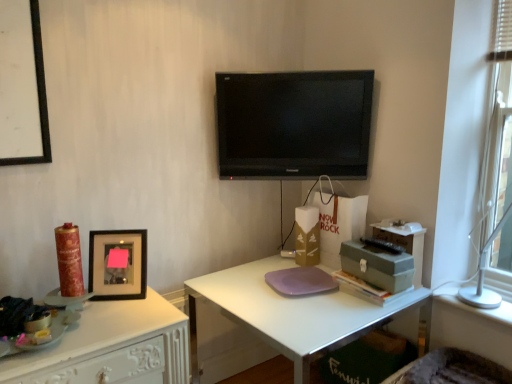
Question: Are white matte desk at center, the second desk from the left, and black glossy flat-screen tv at center making contact?

Choices:
 (A) no
 (B) yes

Answer: (A)

Question: From the image's perspective, is white matte desk at center, positioned as the 1th desk in right-to-left order, above black glossy flat-screen tv at center?

Choices:
 (A) no
 (B) yes

Answer: (A)

Question: Can you confirm if white matte desk at center, positioned as the 1th desk in right-to-left order, is positioned to the right of black glossy flat-screen tv at center?

Choices:
 (A) yes
 (B) no

Answer: (A)

Question: Can black glossy flat-screen tv at center be found inside white matte desk at center, the second desk from the left?

Choices:
 (A) yes
 (B) no

Answer: (B)

Question: Considering the relative sizes of white matte desk at center, the second desk from the left, and black glossy flat-screen tv at center in the image provided, is white matte desk at center, the second desk from the left, shorter than black glossy flat-screen tv at center?

Choices:
 (A) yes
 (B) no

Answer: (B)

Question: From a real-world perspective, does white matte desk at center, positioned as the 1th desk in right-to-left order, stand above black glossy flat-screen tv at center?

Choices:
 (A) no
 (B) yes

Answer: (A)

Question: Could you tell me if fuzzy fabric swivel chair at lower right is turned towards white glossy desk at left, the first desk in the left-to-right sequence?

Choices:
 (A) no
 (B) yes

Answer: (A)

Question: Considering the relative sizes of fuzzy fabric swivel chair at lower right and white glossy desk at left, placed as the 2th desk when sorted from right to left, in the image provided, is fuzzy fabric swivel chair at lower right thinner than white glossy desk at left, placed as the 2th desk when sorted from right to left,?

Choices:
 (A) yes
 (B) no

Answer: (A)

Question: Considering the relative sizes of fuzzy fabric swivel chair at lower right and white glossy desk at left, placed as the 2th desk when sorted from right to left, in the image provided, is fuzzy fabric swivel chair at lower right wider than white glossy desk at left, placed as the 2th desk when sorted from right to left,?

Choices:
 (A) no
 (B) yes

Answer: (A)

Question: Is fuzzy fabric swivel chair at lower right located outside white glossy desk at left, placed as the 2th desk when sorted from right to left?

Choices:
 (A) yes
 (B) no

Answer: (A)

Question: Is the depth of fuzzy fabric swivel chair at lower right less than that of white glossy desk at left, the first desk in the left-to-right sequence?

Choices:
 (A) no
 (B) yes

Answer: (A)

Question: Does fuzzy fabric swivel chair at lower right have a greater height compared to white glossy desk at left, the first desk in the left-to-right sequence?

Choices:
 (A) no
 (B) yes

Answer: (A)

Question: Is white glossy desk at left, placed as the 2th desk when sorted from right to left, touching black glossy flat-screen tv at center?

Choices:
 (A) yes
 (B) no

Answer: (B)